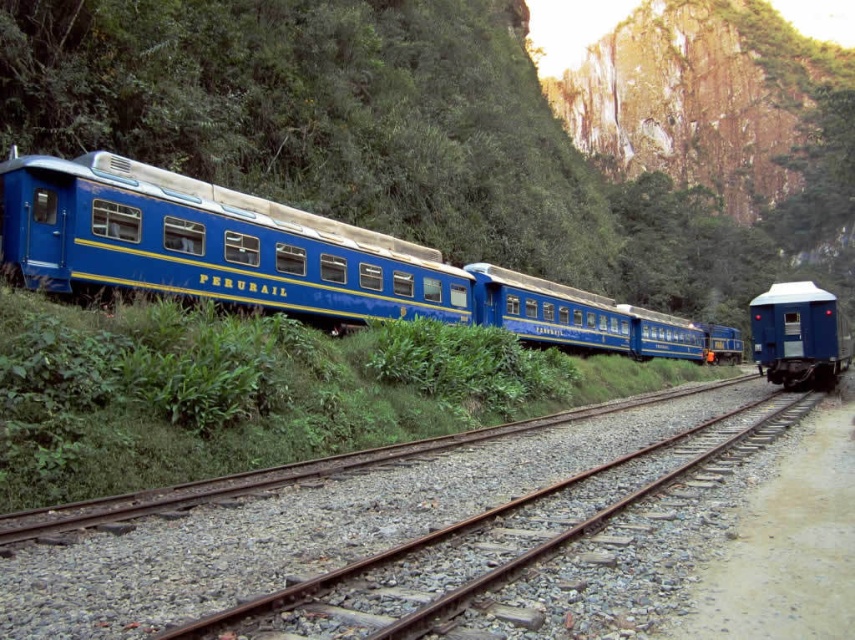
Question: Is blue polished metal train at left smaller than smooth gravel track at center?

Choices:
 (A) yes
 (B) no

Answer: (B)

Question: Which point is closer to the camera taking this photo?

Choices:
 (A) (243, 580)
 (B) (640, 342)
 (C) (823, 310)

Answer: (A)

Question: Which object appears farthest from the camera in this image?

Choices:
 (A) smooth gravel track at center
 (B) blue polished metal train at left
 (C) matte blue train car at right

Answer: (C)

Question: Does smooth gravel track at center have a greater width compared to matte blue train car at right?

Choices:
 (A) yes
 (B) no

Answer: (B)

Question: Does smooth gravel track at center have a greater width compared to matte blue train car at right?

Choices:
 (A) no
 (B) yes

Answer: (A)

Question: Which of these objects is positioned farthest from the matte blue train car at right?

Choices:
 (A) smooth gravel track at center
 (B) blue polished metal train at left

Answer: (B)